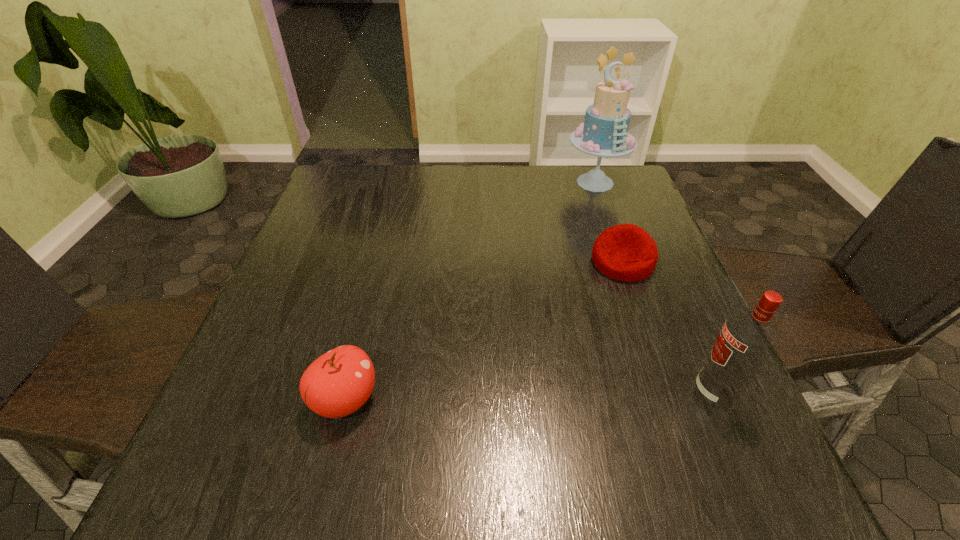
Locate an element on the screen. free space at the right edge of the desktop is located at coordinates (645, 214).

You are a GUI agent. You are given a task and a screenshot of the screen. Output one action in this format:
    pyautogui.click(x=<x>, y=<y>)
    Task: Click on the vacant point located between the third shortest object and the shortest object
    
    Given the screenshot: What is the action you would take?
    pyautogui.click(x=668, y=327)

This screenshot has width=960, height=540. What are the coordinates of `free space between the farthest object and the leftmost object` in the screenshot? It's located at (470, 291).

You are a GUI agent. You are given a task and a screenshot of the screen. Output one action in this format:
    pyautogui.click(x=<x>, y=<y>)
    Task: Click on the free space between the second tallest object and the third nearest object
    
    Given the screenshot: What is the action you would take?
    pyautogui.click(x=668, y=327)

Identify the location of empty location between the vodka and the leftmost object. This screenshot has width=960, height=540. (529, 396).

This screenshot has height=540, width=960. In order to click on vacant space that is in between the shortest object and the farthest object in this screenshot , I will do `click(609, 222)`.

You are a GUI agent. You are given a task and a screenshot of the screen. Output one action in this format:
    pyautogui.click(x=<x>, y=<y>)
    Task: Click on the vacant region between the third shortest object and the cake
    The image size is (960, 540).
    Given the screenshot: What is the action you would take?
    pyautogui.click(x=655, y=288)

This screenshot has height=540, width=960. I want to click on unoccupied area between the apple and the vodka, so click(529, 396).

Locate an element on the screen. free space between the third tallest object and the beanbag is located at coordinates [x=484, y=331].

You are a GUI agent. You are given a task and a screenshot of the screen. Output one action in this format:
    pyautogui.click(x=<x>, y=<y>)
    Task: Click on the empty space that is in between the shortest object and the second tallest object
    The image size is (960, 540).
    Given the screenshot: What is the action you would take?
    pyautogui.click(x=668, y=327)